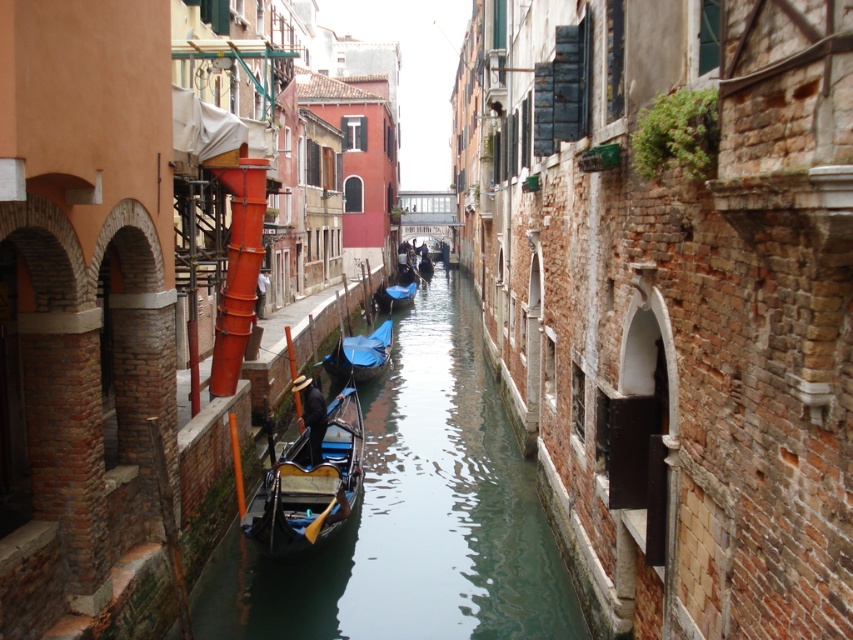
You are standing on a bridge overlooking the canal. You see the smooth dark blue water at center and the blue fabric boat at center. Which object is closer to the bottom of the image?

The smooth dark blue water at center is below the blue fabric boat at center, so it is closer to the bottom of the image.

You are planning to navigate a small boat through the narrow canal in Venice. You see two boats at the center of the canal, a blue glossy gondola at center and a blue fabric boat at center. Which boat do you think would be easier to maneuver around?

The blue glossy gondola at center is thinner than the blue fabric boat at center, so it would be easier to maneuver around the blue glossy gondola at center since it takes up less space in the narrow canal.

You are standing at the edge of the canal in Venice and want to take a photo of a specific point in the scene. The point you want to focus on is located at coordinates point (312, 502). If your camera has a depth sensor that measures distances up to 15 meters, will it be able to accurately capture the depth of that point?

The distance of point (312, 502) from the camera is 13.58 meters, which is within the camera sensor range of 15 meters. Therefore, the camera can accurately capture the depth of that point.